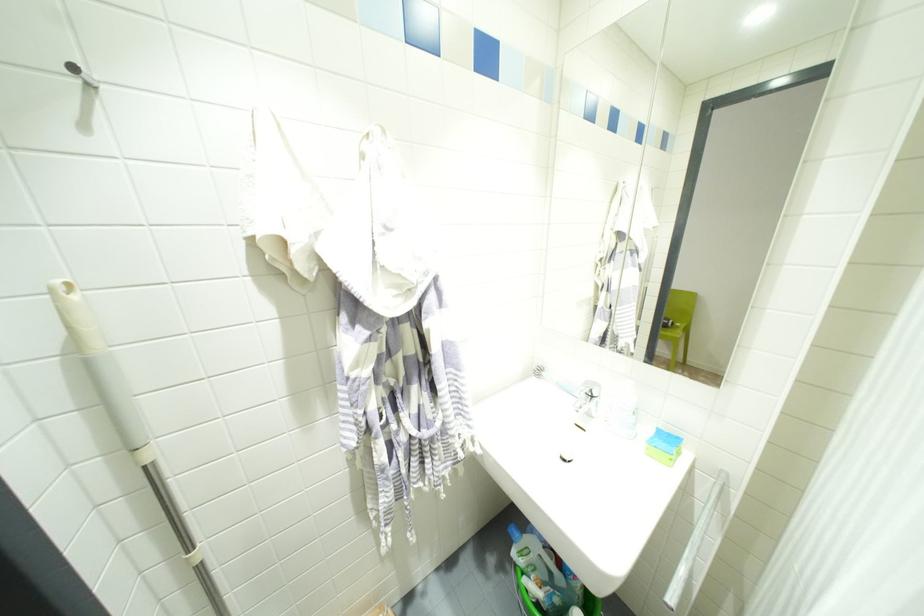
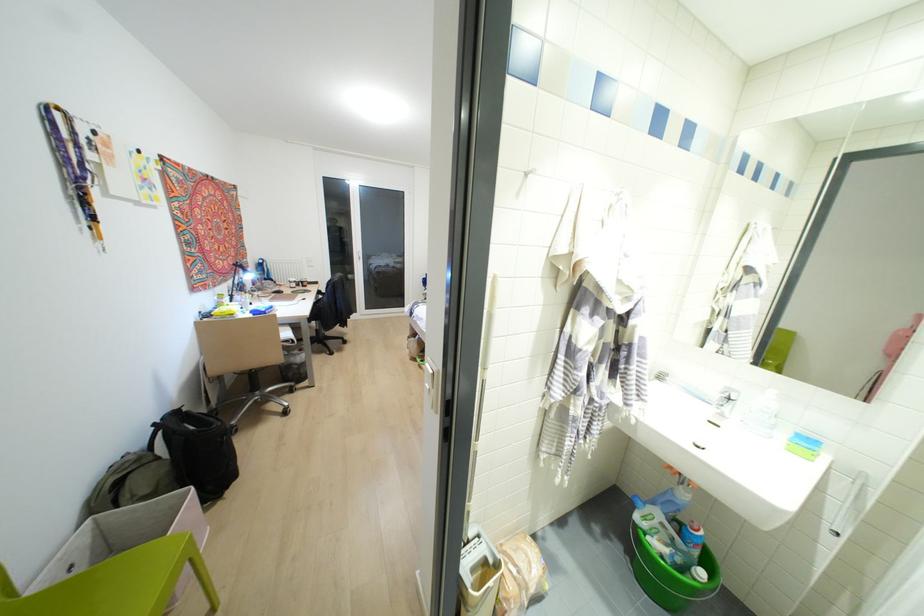
Which direction would the cameraman need to move to produce the second image?

The cameraman moved toward left, backward.